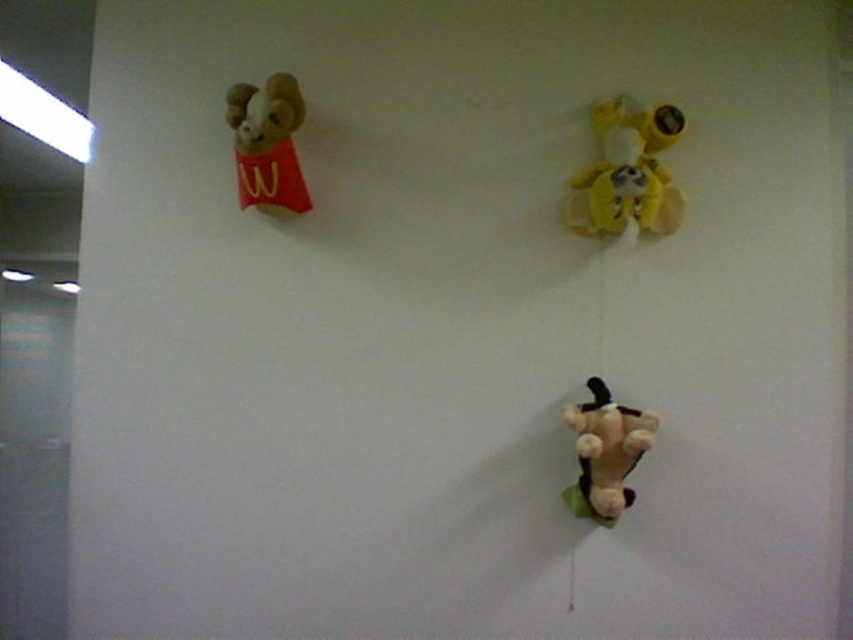
Looking at the wall with the velvet plush ram at upper left and the soft brown plush toy at bottom right, which one is positioned more to the left side of the wall?

The velvet plush ram at upper left is positioned more to the left side of the wall than the soft brown plush toy at bottom right.

You are standing in front of the wall with the three plush toys. There are two points marked on the wall at coordinates point (x=670, y=218) and point (x=273, y=134). Which point is closer to you?

Point (x=273, y=134) is closer to you because it is less further away than point (x=670, y=218).

Consider the image. You are an interior designer planning to rearrange the yellow plush toy at upper right and the velvet plush ram at upper left. The client wants them to be exactly 24 inches apart. Can you adjust their positions to meet this requirement without moving any other items?

Answer: The current distance between the yellow plush toy at upper right and the velvet plush ram at upper left is 21.33 inches. To reach the desired 24 inches, you need to increase the distance by approximately 2.67 inches by moving one or both of them further apart.